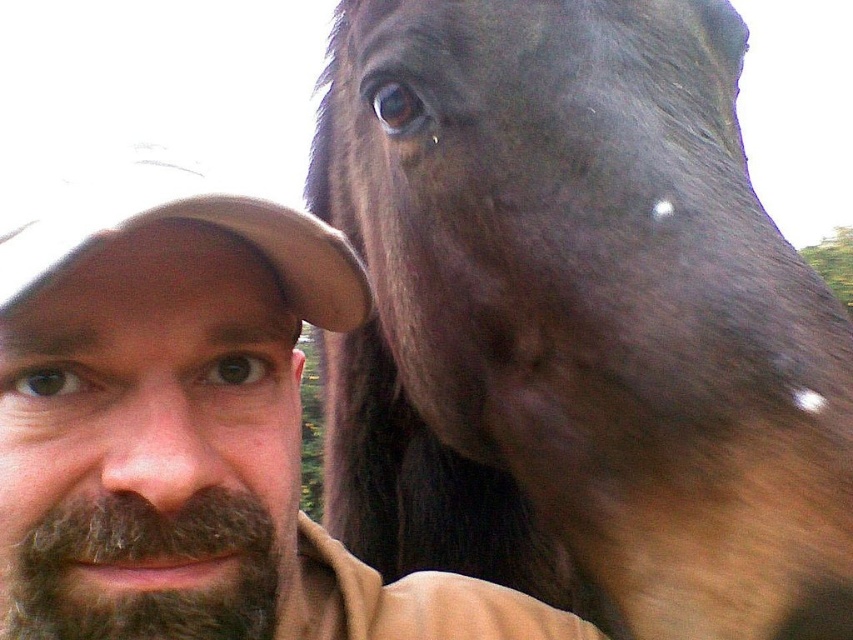
Question: Which is farther from the brown skin/naturalobject at left?

Choices:
 (A) brown beard at left
 (B) dark brown fuzzy beard at lower left
 (C) dark brown fur at upper right
 (D) tan fabric baseball cap at left

Answer: (C)

Question: Does dark brown fur at upper right appear over brown skin/naturalobject at left?

Choices:
 (A) no
 (B) yes

Answer: (B)

Question: Which object is farther from the camera taking this photo?

Choices:
 (A) brown skin/naturalobject at left
 (B) dark brown fur at upper right
 (C) dark brown fuzzy beard at lower left
 (D) brown beard at left

Answer: (C)

Question: Can you confirm if dark brown fur at upper right is positioned above brown skin/naturalobject at left?

Choices:
 (A) yes
 (B) no

Answer: (A)

Question: Based on their relative distances, which object is farther from the tan fabric baseball cap at left?

Choices:
 (A) brown beard at left
 (B) dark brown fur at upper right
 (C) brown skin/naturalobject at left
 (D) dark brown fuzzy beard at lower left

Answer: (B)

Question: Does brown beard at left appear over dark brown fuzzy beard at lower left?

Choices:
 (A) no
 (B) yes

Answer: (A)